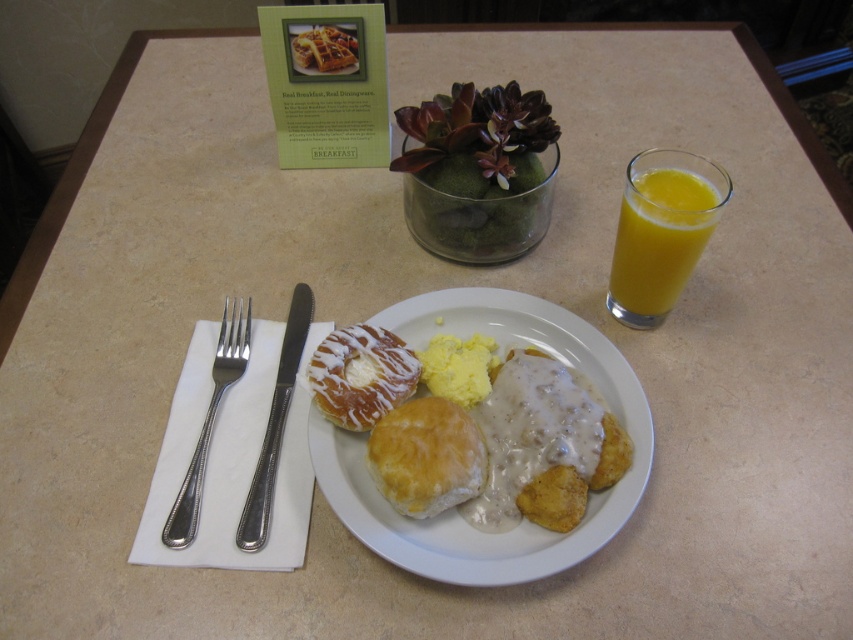
Can you confirm if glazed doughnut at center is smaller than golden crispy waffle at center?

Incorrect, glazed doughnut at center is not smaller in size than golden crispy waffle at center.

Is point (415, 388) positioned behind point (344, 35)?

No, (415, 388) is in front of (344, 35).

Measure the distance between glazed doughnut at center and camera.

glazed doughnut at center and camera are 15.96 inches apart.

The image size is (853, 640). What are the coordinates of `glazed doughnut at center` in the screenshot? It's located at (361, 376).

Between point (511, 560) and point (410, 448), which one is positioned behind?

Positioned behind is point (410, 448).

Which of these two, golden-brown glazed biscuit at center or golden glazed biscuit at center, stands taller?

golden-brown glazed biscuit at center

Locate an element on the screen. The image size is (853, 640). golden-brown glazed biscuit at center is located at coordinates (453, 509).

Between golden glazed biscuit at center and glazed doughnut at center, which one is positioned higher?

glazed doughnut at center is above.

Is golden glazed biscuit at center above glazed doughnut at center?

Actually, golden glazed biscuit at center is below glazed doughnut at center.

Who is more forward, (430, 420) or (379, 364)?

Point (430, 420)

You are a GUI agent. You are given a task and a screenshot of the screen. Output one action in this format:
    pyautogui.click(x=<x>, y=<y>)
    Task: Click on the golden glazed biscuit at center
    
    Given the screenshot: What is the action you would take?
    pyautogui.click(x=426, y=456)